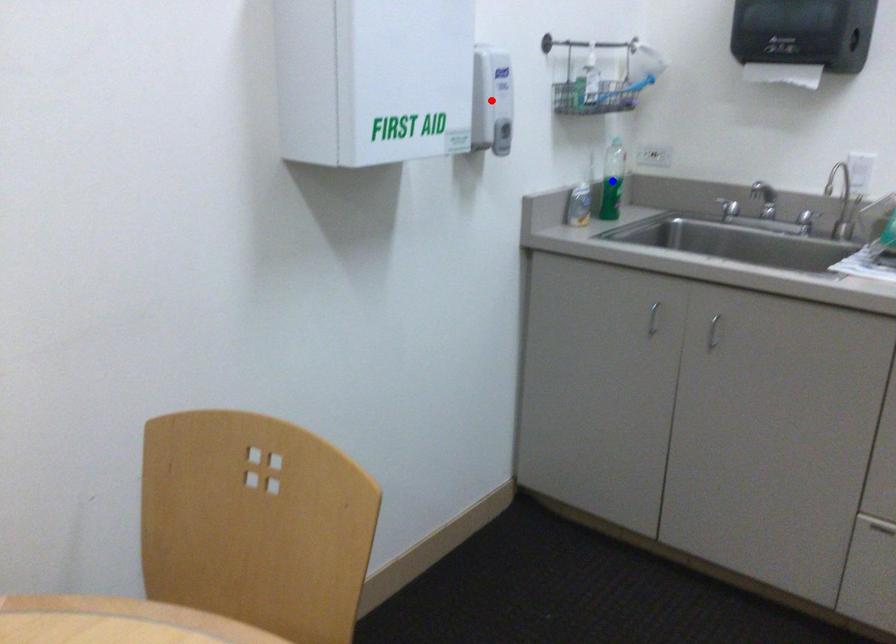
Question: Which of the two points in the image is closer to the camera?

Choices:
 (A) Blue point is closer.
 (B) Red point is closer.

Answer: (B)